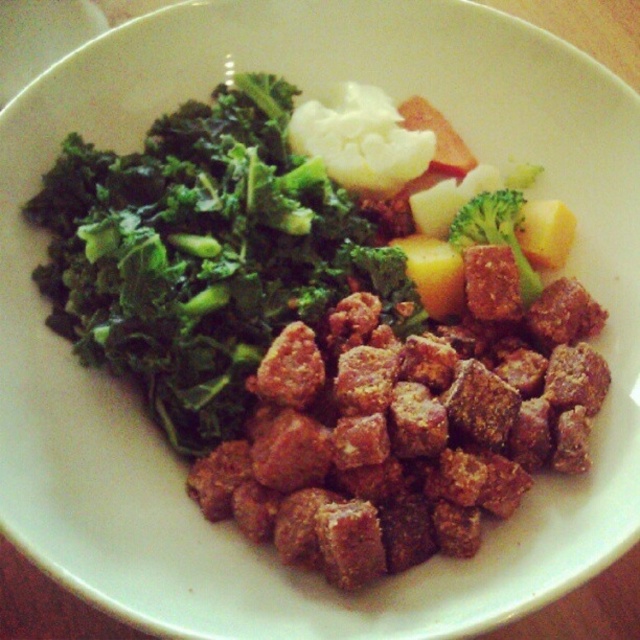
Question: Among these points, which one is nearest to the camera?

Choices:
 (A) (241, 312)
 (B) (392, 560)

Answer: (B)

Question: Is brown crumbly meat at bottom to the left of green matte broccoli at upper center from the viewer's perspective?

Choices:
 (A) no
 (B) yes

Answer: (B)

Question: Which point appears farthest from the camera in this image?

Choices:
 (A) 285,550
 (B) 504,188
 (C) 264,120

Answer: (C)

Question: Which point is closer to the camera?

Choices:
 (A) green matte broccoli at upper center
 (B) brown crumbly meat at bottom

Answer: (B)

Question: Is brown crumbly meat at bottom positioned in front of green matte broccoli at upper center?

Choices:
 (A) yes
 (B) no

Answer: (A)

Question: Is brown crumbly meat at bottom below green matte broccoli at upper center?

Choices:
 (A) no
 (B) yes

Answer: (B)